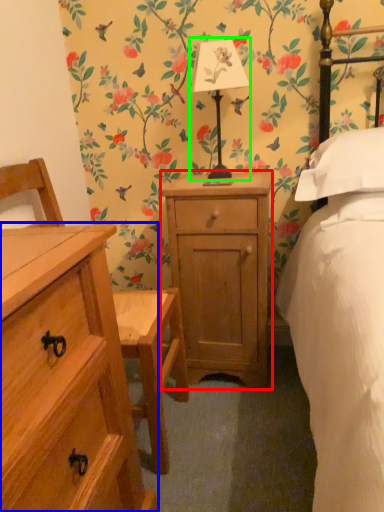
Question: Based on their relative distances, which object is nearer to nightstand (highlighted by a red box)? Choose from chest of drawers (highlighted by a blue box) and bedside lamp (highlighted by a green box).

Choices:
 (A) chest of drawers
 (B) bedside lamp

Answer: (B)